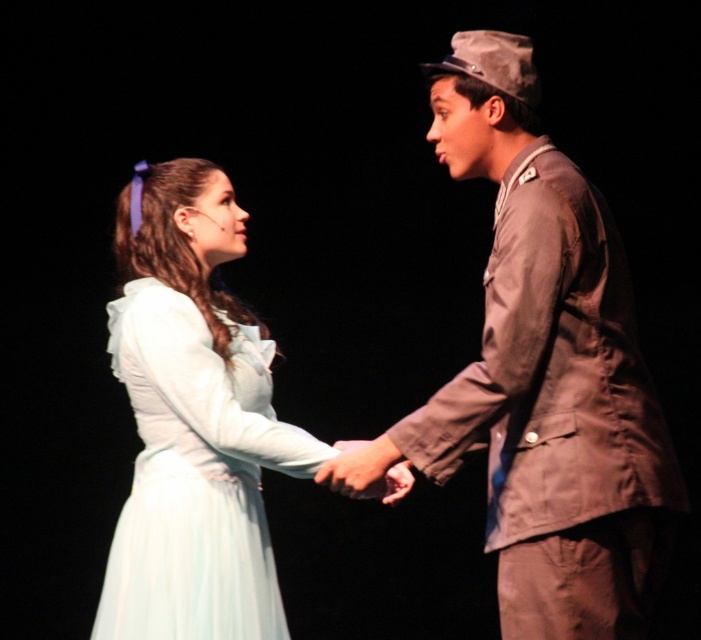
You are a stagehand who needs to place a prop on the stage. The prop is a small box that must be placed exactly at the coordinates where the matte brown uniform at right is located. What are the coordinates where you should place the prop?

The coordinates for the matte brown uniform at right are (x=547, y=371). Place the prop there.

You are a stagehand standing 10 feet away from the camera. You need to adjust the spotlight to focus on the matte brown uniform at right. Can you reach it from your current position without moving closer?

The matte brown uniform at right is 6.72 feet away from the camera. Since you are 10 feet away from the camera, you are farther away than the uniform. Therefore, you cannot reach it without moving closer.